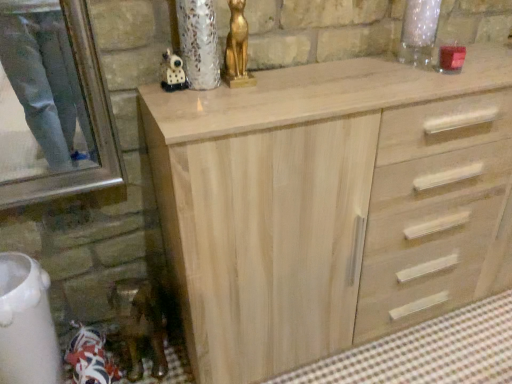
Where is `free space in front of gold metallic cat statue at upper center`? free space in front of gold metallic cat statue at upper center is located at coordinates (228, 94).